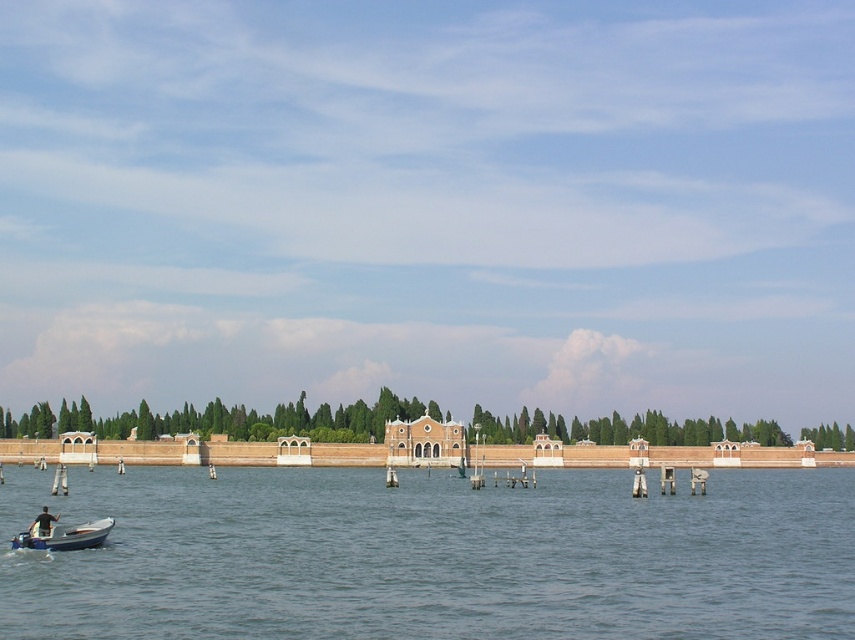
You are standing at the edge of the waterway and see two points marked in the scene. Which point, point (140, 580) or point (101, 529), is nearer to you?

Point (140, 580) is closer to the viewer than point (101, 529).

You are standing on the dock and see the clear water at lower left and dark blue fabric at lower left. Which object is higher in the image?

The clear water at lower left is much taller than the dark blue fabric at lower left, so the clear water at lower left is higher in the image.

You are standing on the edge of the waterway and see the clear water at lower left and the dark blue fabric at lower left. Which object appears bigger in the scene?

The clear water at lower left has a larger size compared to the dark blue fabric at lower left, so the clear water at lower left appears bigger in the scene.